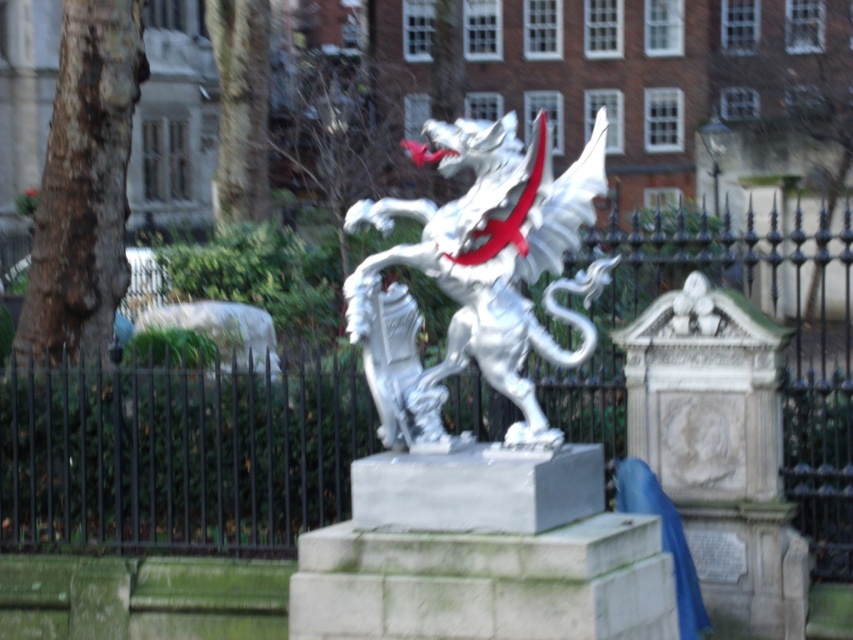
Is black metal fence at center wider than white marble dragon at center?

Yes, black metal fence at center is wider than white marble dragon at center.

Is point (264, 472) farther from camera compared to point (527, 196)?

Yes.

Where is `black metal fence at center`? The width and height of the screenshot is (853, 640). black metal fence at center is located at coordinates (177, 451).